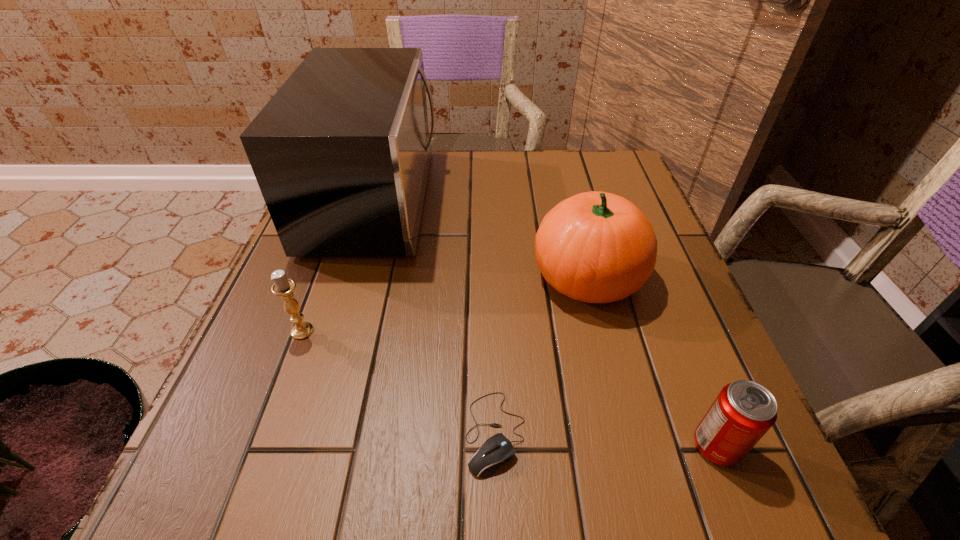
I want to click on free spot that satisfies the following two spatial constraints: 1. on the front side of the third object from right to left; 2. on the left side of the candle holder, so click(265, 433).

The height and width of the screenshot is (540, 960). I want to click on free space that satisfies the following two spatial constraints: 1. with the door open on the microwave oven; 2. on the left side of the soda can, so click(301, 446).

The width and height of the screenshot is (960, 540). Find the location of `vacant point that satisfies the following two spatial constraints: 1. with the door open on the tallest object; 2. on the back side of the shortest object`. vacant point that satisfies the following two spatial constraints: 1. with the door open on the tallest object; 2. on the back side of the shortest object is located at coordinates (306, 433).

Find the location of a particular element. free point that satisfies the following two spatial constraints: 1. with the door open on the second tallest object; 2. on the left side of the tallest object is located at coordinates (352, 276).